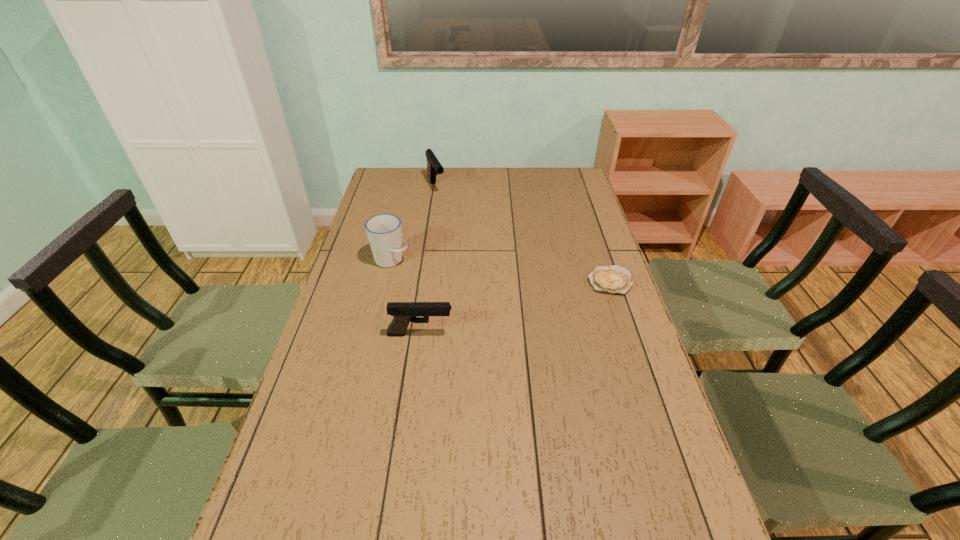
Image resolution: width=960 pixels, height=540 pixels. What are the coordinates of `vacant spot on the desktop that is between the nearest object and the shortest object and is positioned at the barrel of the farthest object` in the screenshot? It's located at (509, 309).

Where is `vacant space on the desktop that is between the nearer pistol and the shortest object and is positioned with a handle on the side of the cup`? This screenshot has width=960, height=540. vacant space on the desktop that is between the nearer pistol and the shortest object and is positioned with a handle on the side of the cup is located at coordinates (515, 307).